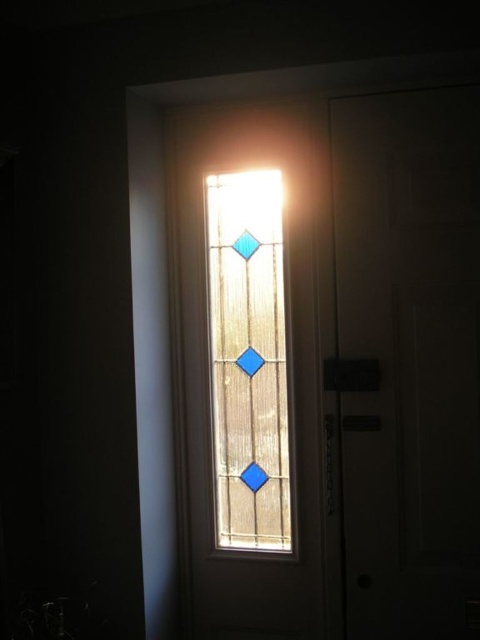
Where is `white matte door at right`? white matte door at right is located at coordinates (408, 358).

Which is behind, point (388, 204) or point (268, 362)?

Positioned behind is point (268, 362).

Locate an element on the screen. The height and width of the screenshot is (640, 480). white matte door at right is located at coordinates (408, 358).